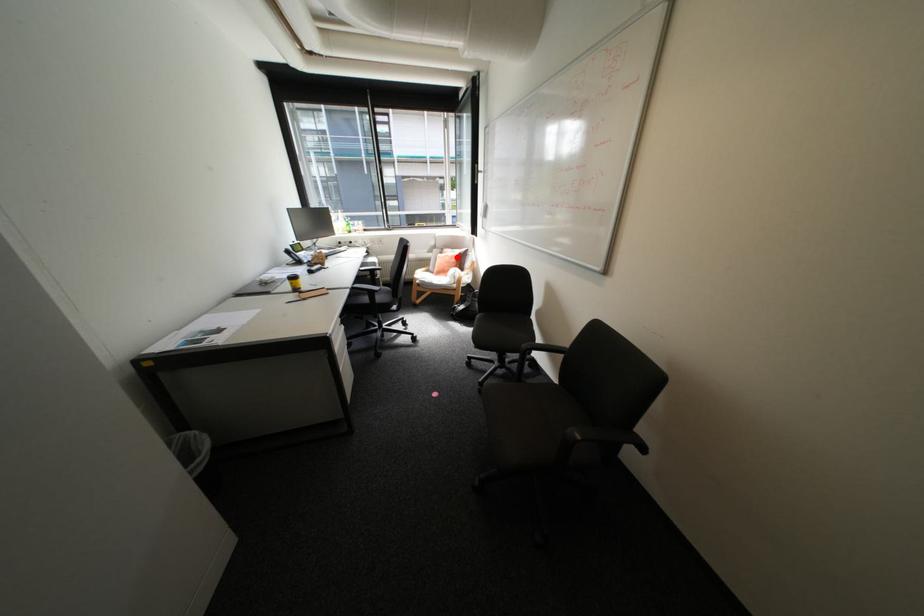
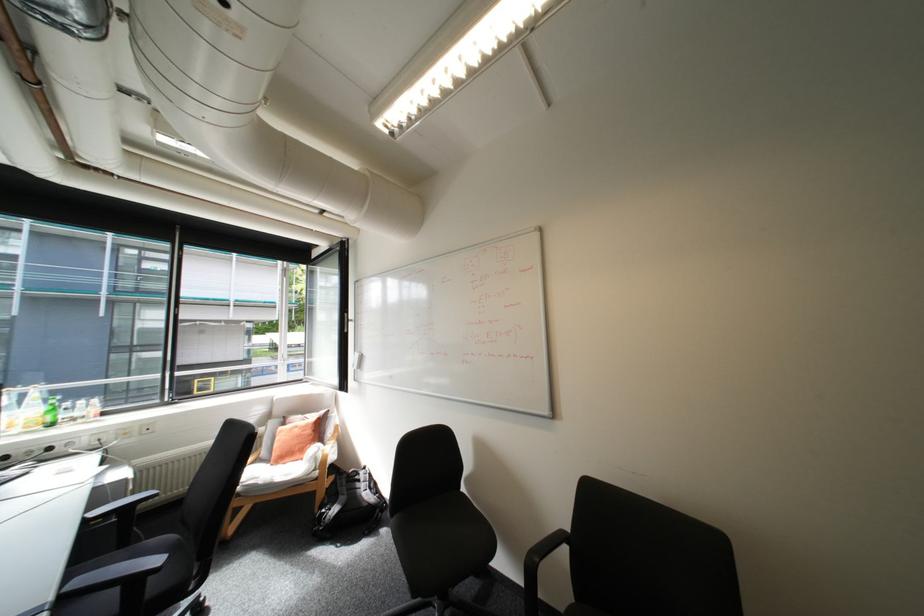
Question: I am providing you with two images of the same scene from different viewpoints. A red point is shown in image1. For the corresponding object point in image2, is it positioned nearer or farther from the camera?

Choices:
 (A) Nearer
 (B) Farther

Answer: (B)